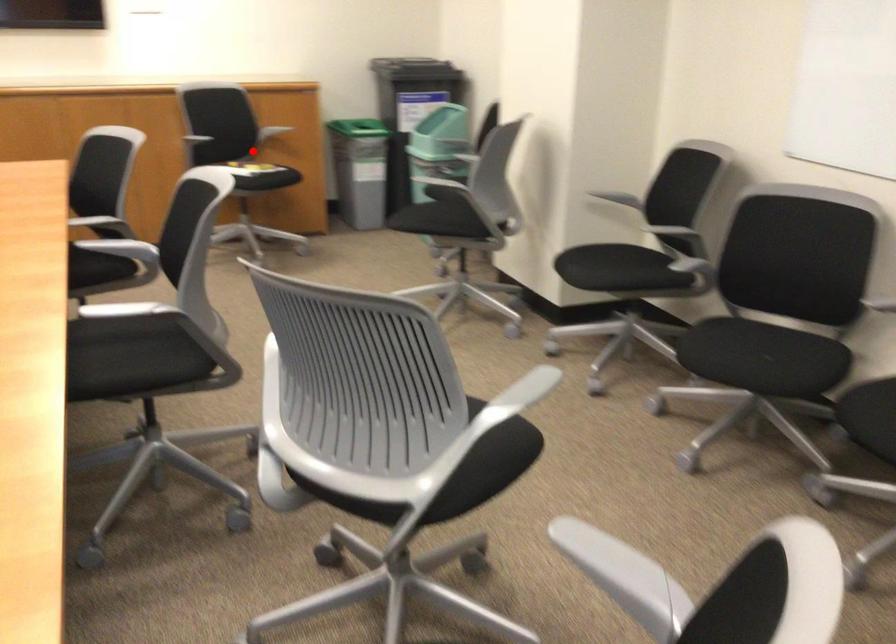
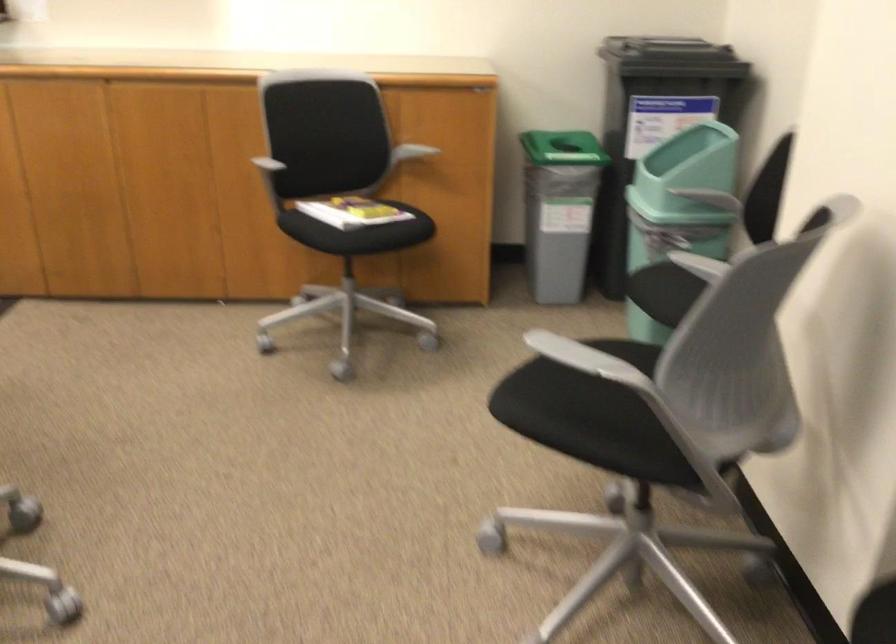
Locate, in the second image, the point that corresponds to the highlighted location in the first image.

(355, 212)